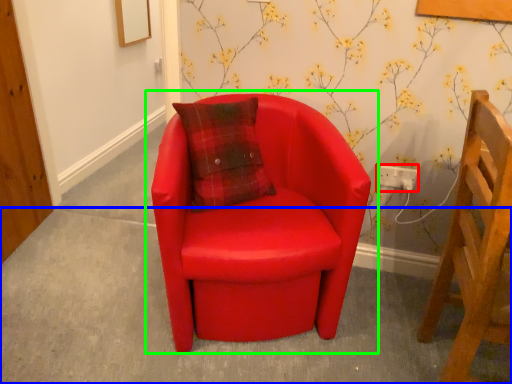
Question: Based on their relative distances, which object is nearer to electric outlet (highlighted by a red box)? Choose from concrete (highlighted by a blue box) and chair (highlighted by a green box).

Choices:
 (A) concrete
 (B) chair

Answer: (B)